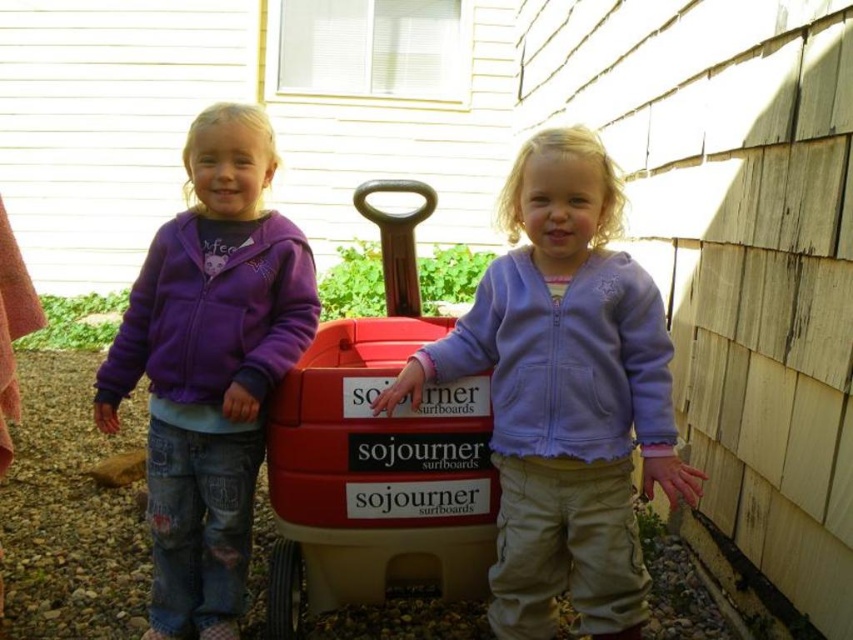
Question: Estimate the real-world distances between objects in this image. Which object is farther from the purple fleece jacket at center?

Choices:
 (A) purple fleece jacket at left
 (B) red plastic toy car at center

Answer: (A)

Question: Is purple fleece jacket at center wider than red plastic toy car at center?

Choices:
 (A) yes
 (B) no

Answer: (A)

Question: Which point is farther to the camera?

Choices:
 (A) (213, 236)
 (B) (392, 396)

Answer: (A)

Question: Is purple fleece jacket at center thinner than red plastic toy car at center?

Choices:
 (A) yes
 (B) no

Answer: (B)

Question: Which object appears farthest from the camera in this image?

Choices:
 (A) purple fleece jacket at left
 (B) red plastic toy car at center
 (C) purple fleece jacket at center

Answer: (A)

Question: Where is purple fleece jacket at left located in relation to red plastic toy car at center in the image?

Choices:
 (A) above
 (B) below

Answer: (A)